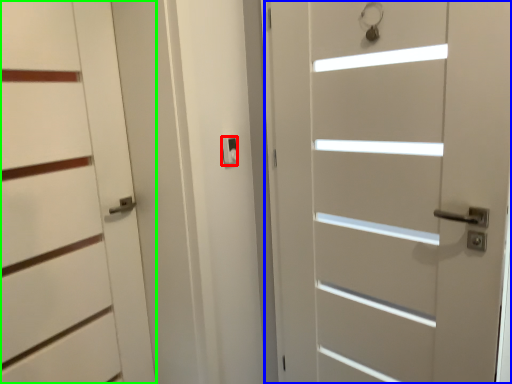
Question: Which is farther away from latch (highlighted by a red box)? door (highlighted by a blue box) or door (highlighted by a green box)?

Choices:
 (A) door
 (B) door

Answer: (A)